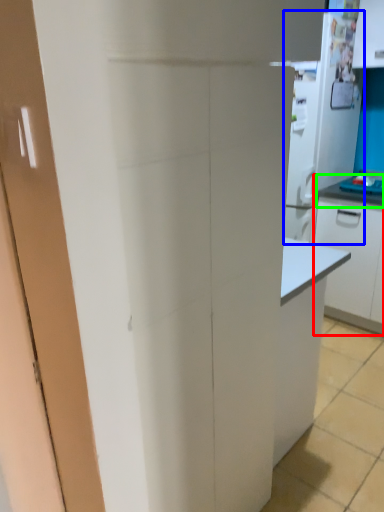
Question: Which object is the farthest from cabinetry (highlighted by a red box)? Choose among these: appliance (highlighted by a blue box) or countertop (highlighted by a green box).

Choices:
 (A) appliance
 (B) countertop

Answer: (A)